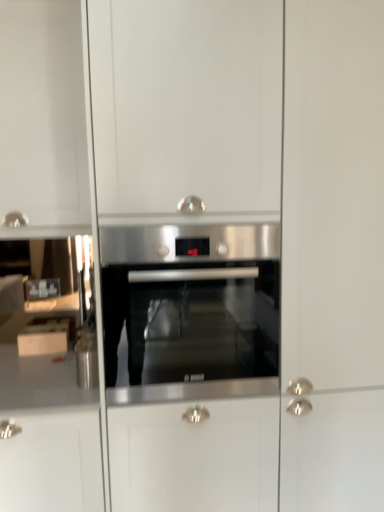
Locate an element on the screen. The image size is (384, 512). stainless steel oven at center is located at coordinates (191, 300).

The width and height of the screenshot is (384, 512). What do you see at coordinates (191, 300) in the screenshot?
I see `stainless steel oven at center` at bounding box center [191, 300].

This screenshot has width=384, height=512. What do you see at coordinates (44, 337) in the screenshot? I see `white glossy cabinet at left` at bounding box center [44, 337].

Locate an element on the screen. The width and height of the screenshot is (384, 512). white glossy cabinet at left is located at coordinates (44, 337).

Image resolution: width=384 pixels, height=512 pixels. I want to click on stainless steel oven at center, so click(191, 300).

Which object is positioned more to the left, white glossy cabinet at left or stainless steel oven at center?

From the viewer's perspective, white glossy cabinet at left appears more on the left side.

Is white glossy cabinet at left closer to camera compared to stainless steel oven at center?

No, it is not.

Is point (48, 339) closer to camera compared to point (159, 247)?

No, it is not.

From the image's perspective, is white glossy cabinet at left below stainless steel oven at center?

Yes, from the image's perspective, white glossy cabinet at left is below stainless steel oven at center.

From a real-world perspective, does white glossy cabinet at left stand above stainless steel oven at center?

Incorrect, from a real-world perspective, white glossy cabinet at left is lower than stainless steel oven at center.

Between white glossy cabinet at left and stainless steel oven at center, which one has larger width?

Wider between the two is stainless steel oven at center.

Who is shorter, white glossy cabinet at left or stainless steel oven at center?

white glossy cabinet at left is shorter.

Between white glossy cabinet at left and stainless steel oven at center, which one has larger size?

stainless steel oven at center is bigger.

Is white glossy cabinet at left situated inside stainless steel oven at center or outside?

white glossy cabinet at left is not inside stainless steel oven at center, it's outside.

Is white glossy cabinet at left in contact with stainless steel oven at center?

No.

Is white glossy cabinet at left positioned with its back to stainless steel oven at center?

No, stainless steel oven at center is not at the back of white glossy cabinet at left.

What's the angular difference between white glossy cabinet at left and stainless steel oven at center's facing directions?

white glossy cabinet at left and stainless steel oven at center are facing 0.000817 degrees away from each other.

How much distance is there between white glossy cabinet at left and stainless steel oven at center?

They are 28.89 inches apart.

Identify the location of oven above the white glossy cabinet at left (from the image's perspective). (191, 300).

Which object is positioned more to the right, stainless steel oven at center or white glossy cabinet at left?

From the viewer's perspective, stainless steel oven at center appears more on the right side.

Considering the positions of objects stainless steel oven at center and white glossy cabinet at left in the image provided, who is behind, stainless steel oven at center or white glossy cabinet at left?

white glossy cabinet at left.

Which point is more forward, [215,360] or [56,338]?

Positioned in front is point [215,360].

From the image's perspective, is stainless steel oven at center located above or below white glossy cabinet at left?

stainless steel oven at center is situated higher than white glossy cabinet at left in the image.

From a real-world perspective, which is physically above, stainless steel oven at center or white glossy cabinet at left?

In real-world perspective, stainless steel oven at center is above.

Which of these two, stainless steel oven at center or white glossy cabinet at left, is thinner?

white glossy cabinet at left.

Can you confirm if stainless steel oven at center is taller than white glossy cabinet at left?

Yes, stainless steel oven at center is taller than white glossy cabinet at left.

Considering the sizes of stainless steel oven at center and white glossy cabinet at left in the image, is stainless steel oven at center bigger or smaller than white glossy cabinet at left?

In the image, stainless steel oven at center appears to be larger than white glossy cabinet at left.

Does stainless steel oven at center contain white glossy cabinet at left?

No, white glossy cabinet at left is located outside of stainless steel oven at center.

Is stainless steel oven at center far from white glossy cabinet at left?

They are positioned close to each other.

Is stainless steel oven at center oriented away from white glossy cabinet at left?

No, stainless steel oven at center's orientation is not away from white glossy cabinet at left.

What's the angular difference between stainless steel oven at center and white glossy cabinet at left's facing directions?

stainless steel oven at center and white glossy cabinet at left are facing 0.000817 degrees away from each other.

Measure the distance from stainless steel oven at center to white glossy cabinet at left.

The distance of stainless steel oven at center from white glossy cabinet at left is 28.89 inches.

I want to click on oven above the white glossy cabinet at left (from a real-world perspective), so click(191, 300).

Where is `cabinetry lying behind the stainless steel oven at center`? cabinetry lying behind the stainless steel oven at center is located at coordinates (44, 337).

Where is `oven located in front of the white glossy cabinet at left`? The width and height of the screenshot is (384, 512). oven located in front of the white glossy cabinet at left is located at coordinates (191, 300).